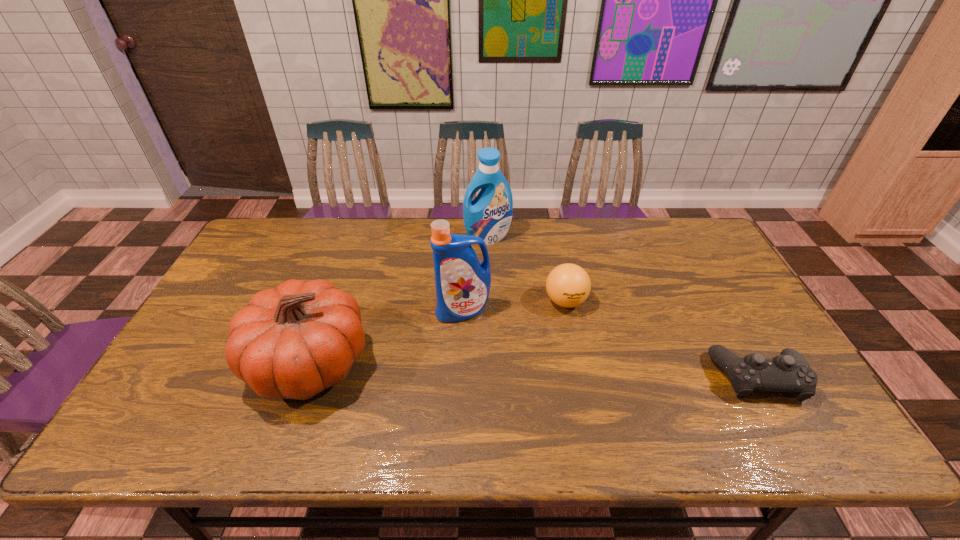
I want to click on vacant spot on the desktop that is between the third shortest object and the shortest object and is positioned on the front-facing side of the farther detergent, so click(x=532, y=370).

Find the location of `free space on the desktop that is between the leftmost object and the shortest object and is positioned on the side with brand of the fourth tallest object`. free space on the desktop that is between the leftmost object and the shortest object and is positioned on the side with brand of the fourth tallest object is located at coordinates point(559,371).

Locate an element on the screen. This screenshot has height=540, width=960. free space on the desktop that is between the third tallest object and the shortest object and is positioned on the label of the nearer detergent is located at coordinates (470, 368).